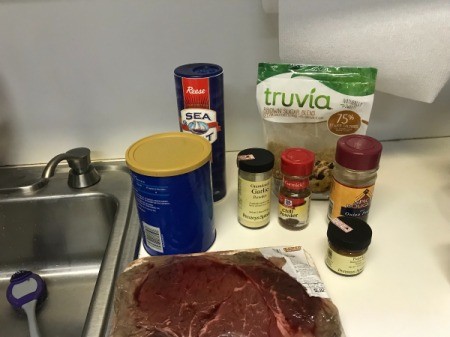
Locate an element on the screen. white wall is located at coordinates (154, 65).